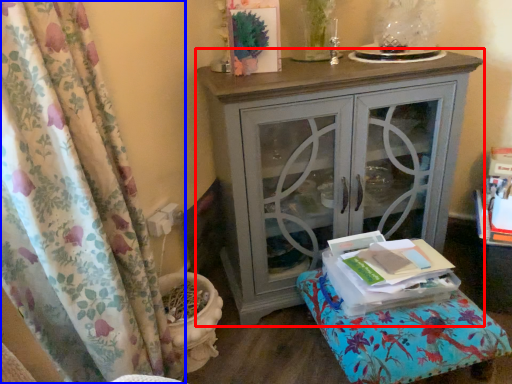
Question: Among these objects, which one is farthest to the camera, nightstand (highlighted by a red box) or curtain (highlighted by a blue box)?

Choices:
 (A) nightstand
 (B) curtain

Answer: (A)